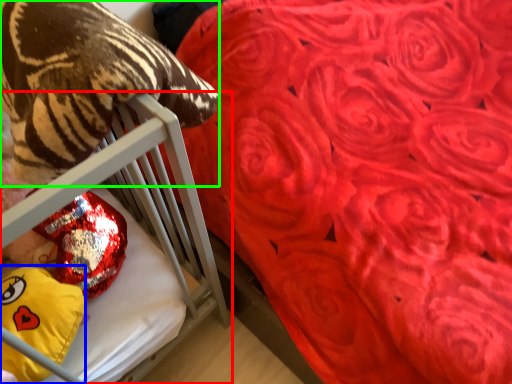
Question: Considering the real-world distances, which object is closest to furniture (highlighted by a red box)? throw pillow (highlighted by a blue box) or animal (highlighted by a green box).

Choices:
 (A) throw pillow
 (B) animal

Answer: (B)